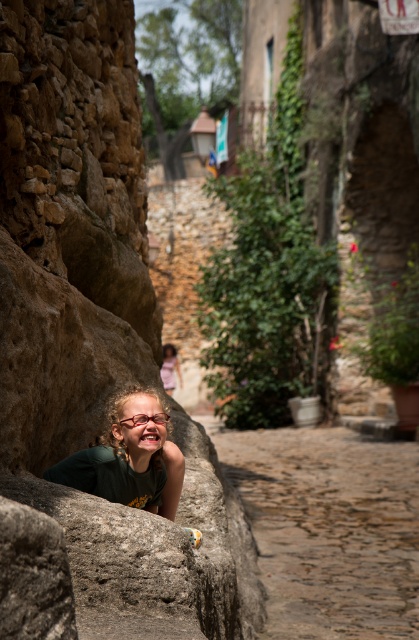
Question: Among these points, which one is farthest from the camera?

Choices:
 (A) (36, 228)
 (B) (167, 378)
 (C) (141, 435)

Answer: (B)

Question: Can you confirm if green fabric face at lower left is positioned to the left of matte pink dress at center?

Choices:
 (A) yes
 (B) no

Answer: (B)

Question: Does brown rough stone at lower left appear on the right side of green fabric face at lower left?

Choices:
 (A) no
 (B) yes

Answer: (A)

Question: Observing the image, what is the correct spatial positioning of green fabric face at lower left in reference to matte pink dress at center?

Choices:
 (A) right
 (B) left

Answer: (A)

Question: Among these objects, which one is farthest from the camera?

Choices:
 (A) matte pink dress at center
 (B) green fabric face at lower left

Answer: (A)

Question: Which point is farther to the camera?

Choices:
 (A) matte pink dress at center
 (B) brown rough stone at lower left

Answer: (A)